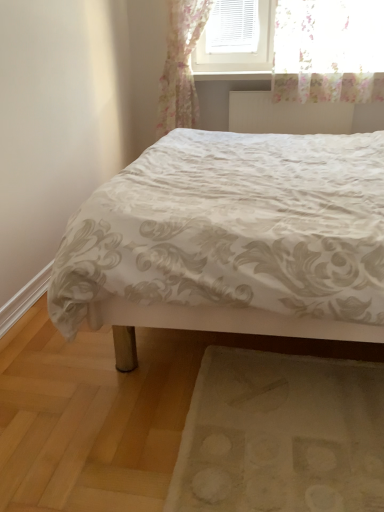
I want to click on beige fabric mat at lower right, so click(281, 435).

Locate an element on the screen. Image resolution: width=384 pixels, height=512 pixels. white satin bed at center is located at coordinates (229, 233).

Locate an element on the screen. beige fabric mat at lower right is located at coordinates (281, 435).

From the image's perspective, is white satin bed at center on beige fabric mat at lower right?

Yes, from the image's perspective, white satin bed at center is above beige fabric mat at lower right.

In the image, is white satin bed at center positioned in front of or behind beige fabric mat at lower right?

Visually, white satin bed at center is located in front of beige fabric mat at lower right.

From a real-world perspective, is white satin bed at center over beige fabric mat at lower right?

Yes, from a real-world perspective, white satin bed at center is on top of beige fabric mat at lower right.

Considering the sizes of objects white satin bed at center and beige fabric mat at lower right in the image provided, who is shorter, white satin bed at center or beige fabric mat at lower right?

Standing shorter between the two is beige fabric mat at lower right.

Which object is wider, white textured radiator at upper center or beige fabric mat at lower right?

With larger width is beige fabric mat at lower right.

Is white textured radiator at upper center positioned with its back to beige fabric mat at lower right?

No, white textured radiator at upper center is not facing the opposite direction of beige fabric mat at lower right.

From the image's perspective, is white textured radiator at upper center positioned above or below beige fabric mat at lower right?

From the image's perspective, white textured radiator at upper center appears above beige fabric mat at lower right.

Based on the photo, from a real-world perspective, is white textured radiator at upper center positioned over beige fabric mat at lower right based on gravity?

Yes, from a real-world perspective, white textured radiator at upper center is on top of beige fabric mat at lower right.

At what (x,y) coordinates should I click in order to perform the action: click on radiator that is behind the white satin bed at center. Please return your answer as a coordinate pair (x, y). Looking at the image, I should click on (286, 115).

Is the depth of white textured radiator at upper center greater than that of white satin bed at center?

Yes, white textured radiator at upper center is further from the viewer.

Is white satin bed at center at the back of white textured radiator at upper center?

No, white satin bed at center is not at the back of white textured radiator at upper center.

Between white satin bed at center and white textured radiator at upper center, which one has less height?

Standing shorter between the two is white textured radiator at upper center.

Is white satin bed at center positioned far away from white textured radiator at upper center?

Yes, white satin bed at center and white textured radiator at upper center are located far from each other.

From the image's perspective, is white satin bed at center above white textured radiator at upper center?

No, from the image's perspective, white satin bed at center is not on top of white textured radiator at upper center.

What's the angular difference between beige fabric mat at lower right and white textured radiator at upper center's facing directions?

2.13 degrees separate the facing orientations of beige fabric mat at lower right and white textured radiator at upper center.

In the scene shown: Is beige fabric mat at lower right taller or shorter than white textured radiator at upper center?

Clearly, beige fabric mat at lower right is shorter compared to white textured radiator at upper center.

Measure the distance from beige fabric mat at lower right to white textured radiator at upper center.

beige fabric mat at lower right and white textured radiator at upper center are 6.93 feet apart from each other.

From a real-world perspective, does beige fabric mat at lower right stand above white textured radiator at upper center?

No.

Where is `bed located in front of the beige fabric mat at lower right`? bed located in front of the beige fabric mat at lower right is located at coordinates (229, 233).

Is beige fabric mat at lower right looking in the opposite direction of white satin bed at center?

Yes.

Is point (381, 506) closer to camera compared to point (264, 238)?

Yes.

Consider the image. Is beige fabric mat at lower right touching white satin bed at center?

They are not placed beside each other.

This screenshot has height=512, width=384. Identify the location of bed lying in front of the beige fabric mat at lower right. (229, 233).

The width and height of the screenshot is (384, 512). I want to click on mat below the white textured radiator at upper center (from the image's perspective), so click(281, 435).

Considering their positions, is white textured radiator at upper center positioned closer to white satin bed at center than beige fabric mat at lower right?

beige fabric mat at lower right is positioned closer to the anchor white satin bed at center.

Estimate the real-world distances between objects in this image. Which object is closer to beige fabric mat at lower right, white textured radiator at upper center or white satin bed at center?

white satin bed at center.

From the image, which object appears to be nearer to white textured radiator at upper center, white satin bed at center or beige fabric mat at lower right?

white satin bed at center is closer to white textured radiator at upper center.

Considering their positions, is beige fabric mat at lower right positioned closer to white textured radiator at upper center than white satin bed at center?

white satin bed at center is positioned closer to the anchor white textured radiator at upper center.

Looking at this image, when comparing their distances from beige fabric mat at lower right, does white satin bed at center or white textured radiator at upper center seem further?

white textured radiator at upper center is further to beige fabric mat at lower right.

Consider the image. Looking at the image, which one is located closer to white satin bed at center, beige fabric mat at lower right or white textured radiator at upper center?

Among the two, beige fabric mat at lower right is located nearer to white satin bed at center.

Image resolution: width=384 pixels, height=512 pixels. In order to click on mat positioned between white satin bed at center and white textured radiator at upper center from near to far in this screenshot , I will do `click(281, 435)`.